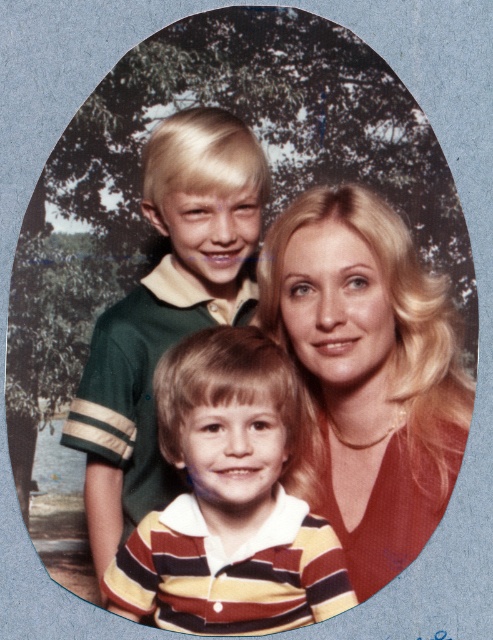
Question: Is blonde hair at center below striped cotton shirt at center?

Choices:
 (A) yes
 (B) no

Answer: (B)

Question: Which of the following is the farthest from the observer?

Choices:
 (A) blonde hair at center
 (B) matte green polo shirt at upper left
 (C) striped cotton shirt at center
 (D) green jersey at center

Answer: (D)

Question: Which object is closer to the camera taking this photo?

Choices:
 (A) blonde hair at center
 (B) matte green polo shirt at upper left
 (C) striped cotton shirt at center

Answer: (C)

Question: Does blonde hair at center have a smaller size compared to green jersey at center?

Choices:
 (A) yes
 (B) no

Answer: (A)

Question: Among these points, which one is farthest from the camera?

Choices:
 (A) (247, 252)
 (B) (234, 381)
 (C) (322, 253)

Answer: (A)

Question: Is matte green polo shirt at upper left to the left of green jersey at center from the viewer's perspective?

Choices:
 (A) yes
 (B) no

Answer: (B)